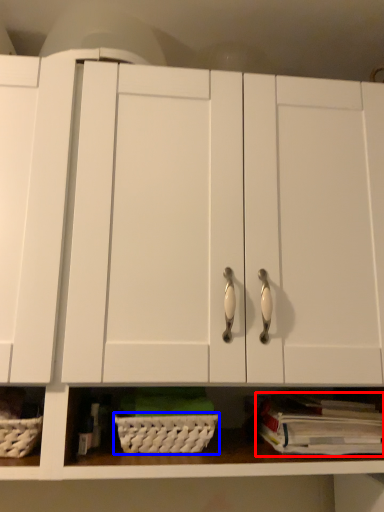
Question: Which object is further to the camera taking this photo, book (highlighted by a red box) or basket (highlighted by a blue box)?

Choices:
 (A) book
 (B) basket

Answer: (B)